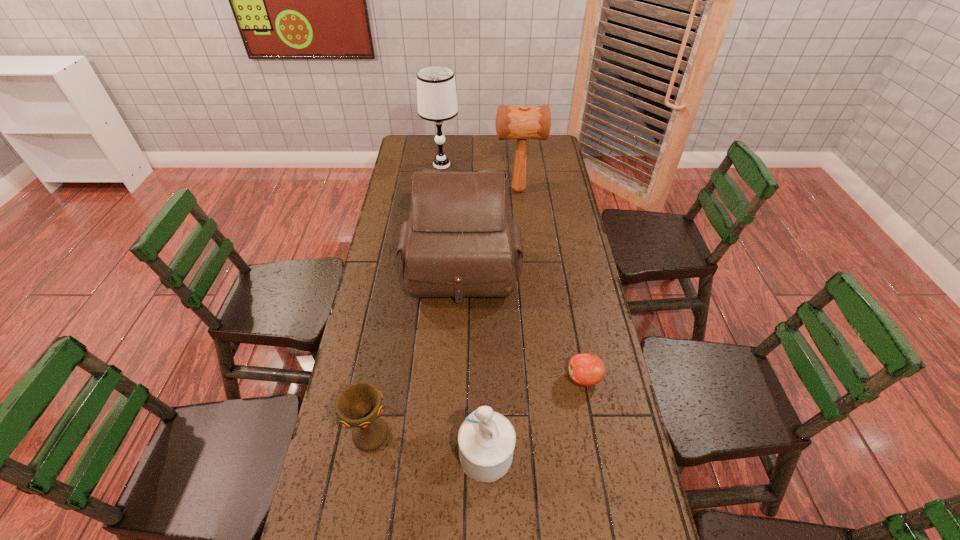
I want to click on blank region between the farthest object and the fifth tallest object, so click(x=406, y=299).

The height and width of the screenshot is (540, 960). In order to click on vacant space in between the figurine and the second shortest object in this screenshot , I will do `click(428, 444)`.

Where is `vacant point located between the mallet and the third nearest object`? The width and height of the screenshot is (960, 540). vacant point located between the mallet and the third nearest object is located at coordinates (551, 284).

At what (x,y) coordinates should I click in order to perform the action: click on empty location between the figurine and the satchel. Please return your answer as a coordinate pair (x, y). The image size is (960, 540). Looking at the image, I should click on (474, 361).

This screenshot has height=540, width=960. In order to click on free space that is in between the third shortest object and the farthest object in this screenshot , I will do `click(464, 310)`.

The image size is (960, 540). I want to click on free space that is in between the fourth nearest object and the chalice, so click(x=417, y=350).

This screenshot has height=540, width=960. What are the coordinates of `vacant space that is in between the figurine and the fourth farthest object` in the screenshot? It's located at (536, 416).

Locate an element on the screen. The image size is (960, 540). unoccupied position between the fourth tallest object and the farthest object is located at coordinates (464, 310).

Locate an element on the screen. The width and height of the screenshot is (960, 540). object that is the fifth closest to the apple is located at coordinates (436, 91).

You are a GUI agent. You are given a task and a screenshot of the screen. Output one action in this format:
    pyautogui.click(x=<x>, y=<y>)
    Task: Click on the object identified as the fourth closest to the second shortest object
    The image size is (960, 540).
    Given the screenshot: What is the action you would take?
    pyautogui.click(x=526, y=122)